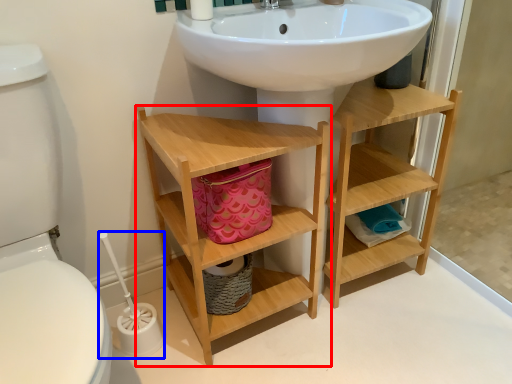
Question: Among these objects, which one is farthest to the camera, bathroom cabinet (highlighted by a red box) or brush (highlighted by a blue box)?

Choices:
 (A) bathroom cabinet
 (B) brush

Answer: (B)